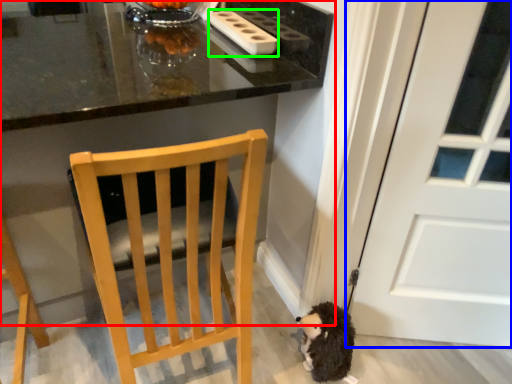
Question: Which is farther away from table (highlighted by a red box)? door (highlighted by a blue box) or appliance (highlighted by a green box)?

Choices:
 (A) door
 (B) appliance

Answer: (A)